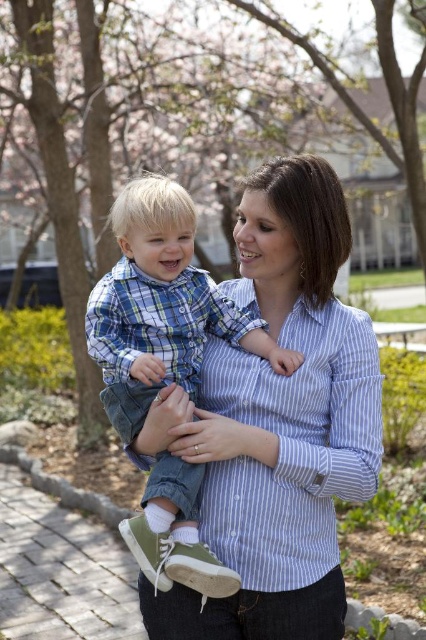
Question: Which point is farther to the camera?

Choices:
 (A) blue striped shirt at center
 (B) blue plaid shirt at center

Answer: (A)

Question: Can you confirm if blue striped shirt at center is positioned to the right of blue plaid shirt at center?

Choices:
 (A) no
 (B) yes

Answer: (B)

Question: Can you confirm if blue striped shirt at center is positioned to the left of blue plaid shirt at center?

Choices:
 (A) yes
 (B) no

Answer: (B)

Question: Observing the image, what is the correct spatial positioning of blue striped shirt at center in reference to blue plaid shirt at center?

Choices:
 (A) right
 (B) left

Answer: (A)